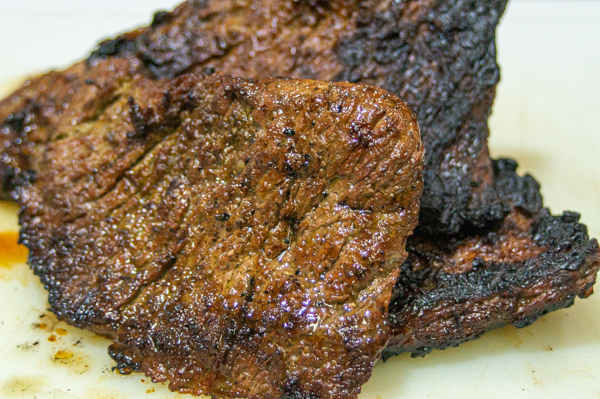
The image size is (600, 399). I want to click on cutting board dents, so click(x=17, y=323), click(x=482, y=380), click(x=503, y=367), click(x=426, y=378).